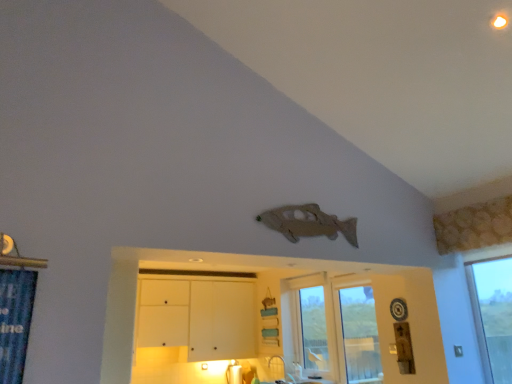
Consider the image. Measure the distance between wooden fish at upper center, marked as the second dresser in a back-to-front arrangement, and camera.

7.07 feet.

Where is `blue fabric shower curtain at left`? This screenshot has height=384, width=512. blue fabric shower curtain at left is located at coordinates (15, 321).

What is the approximate width of transparent glass window at center, acting as the second window starting from the front?

The width of transparent glass window at center, acting as the second window starting from the front, is 12.19 inches.

Locate an element on the screen. white matte cabinet at lower center, which is counted as the 1th dresser, starting from the back is located at coordinates (197, 317).

Is wooden fish at upper center, marked as the second dresser in a back-to-front arrangement, positioned far away from transparent glass door at center, the 2th window from the back?

No, wooden fish at upper center, marked as the second dresser in a back-to-front arrangement, is in close proximity to transparent glass door at center, the 2th window from the back.

Is wooden fish at upper center, which is the first dresser from front to back, inside the boundaries of transparent glass door at center, the 2th window from the back, or outside?

The correct answer is: outside.

In the scene shown: Would you say wooden fish at upper center, which is the first dresser from front to back, is to the left or to the right of transparent glass door at center, which is the first window in front-to-back order, in the picture?

Clearly, wooden fish at upper center, which is the first dresser from front to back, is on the left of transparent glass door at center, which is the first window in front-to-back order, in the image.

Is the position of wooden fish at upper center, marked as the second dresser in a back-to-front arrangement, more distant than that of transparent glass door at center, which is the first window in front-to-back order?

No, wooden fish at upper center, marked as the second dresser in a back-to-front arrangement, is in front of transparent glass door at center, which is the first window in front-to-back order.

Is transparent glass window at center, acting as the second window starting from the front, inside blue fabric shower curtain at left?

No, transparent glass window at center, acting as the second window starting from the front, is not a part of blue fabric shower curtain at left.

Which point is more distant from viewer, [34,271] or [308,346]?

Positioned behind is point [308,346].

How many degrees apart are the facing directions of blue fabric shower curtain at left and transparent glass window at center, acting as the second window starting from the front?

The angle between the facing direction of blue fabric shower curtain at left and the facing direction of transparent glass window at center, acting as the second window starting from the front, is 92 degrees.

You are a GUI agent. You are given a task and a screenshot of the screen. Output one action in this format:
    pyautogui.click(x=<x>, y=<y>)
    Task: Click on the shower curtain above the transparent glass window at center, which appears as the first window when viewed from the back (from a real-world perspective)
    The image size is (512, 384).
    Given the screenshot: What is the action you would take?
    pyautogui.click(x=15, y=321)

Is transparent glass door at center, which is the first window in front-to-back order, far away from wooden fish at upper center, which is the first dresser from front to back?

No, transparent glass door at center, which is the first window in front-to-back order, is in close proximity to wooden fish at upper center, which is the first dresser from front to back.

Is transparent glass door at center, which is the first window in front-to-back order, to the left or to the right of wooden fish at upper center, marked as the second dresser in a back-to-front arrangement, in the image?

Clearly, transparent glass door at center, which is the first window in front-to-back order, is on the right of wooden fish at upper center, marked as the second dresser in a back-to-front arrangement, in the image.

From the image's perspective, does transparent glass door at center, the 2th window from the back, appear higher than wooden fish at upper center, marked as the second dresser in a back-to-front arrangement?

Incorrect, from the image's perspective, transparent glass door at center, the 2th window from the back, is lower than wooden fish at upper center, marked as the second dresser in a back-to-front arrangement.

Choose the correct answer: Is transparent glass door at center, the 2th window from the back, inside wooden fish at upper center, which is the first dresser from front to back, or outside it?

transparent glass door at center, the 2th window from the back, is outside wooden fish at upper center, which is the first dresser from front to back.

Would you say blue fabric shower curtain at left is inside or outside white matte cabinet at lower center, which is counted as the 1th dresser, starting from the back?

blue fabric shower curtain at left lies outside white matte cabinet at lower center, which is counted as the 1th dresser, starting from the back.

From a real-world perspective, is blue fabric shower curtain at left positioned above or below white matte cabinet at lower center, positioned as the 2th dresser in front-to-back order?

In terms of real-world spatial position, blue fabric shower curtain at left is below white matte cabinet at lower center, positioned as the 2th dresser in front-to-back order.

Considering the relative positions of blue fabric shower curtain at left and white matte cabinet at lower center, positioned as the 2th dresser in front-to-back order, in the image provided, is blue fabric shower curtain at left in front of white matte cabinet at lower center, positioned as the 2th dresser in front-to-back order,?

Yes, blue fabric shower curtain at left is in front of white matte cabinet at lower center, positioned as the 2th dresser in front-to-back order.

Is point (376, 355) farther from camera compared to point (180, 315)?

No, (376, 355) is closer to viewer.

Does transparent glass door at center, which is the first window in front-to-back order, turn towards white matte cabinet at lower center, which is counted as the 1th dresser, starting from the back?

No, transparent glass door at center, which is the first window in front-to-back order, does not turn towards white matte cabinet at lower center, which is counted as the 1th dresser, starting from the back.

Between transparent glass door at center, the 2th window from the back, and white matte cabinet at lower center, positioned as the 2th dresser in front-to-back order, which one is positioned behind?

white matte cabinet at lower center, positioned as the 2th dresser in front-to-back order.

From the image's perspective, relative to wooden fish at upper center, which is the first dresser from front to back, is blue fabric shower curtain at left above or below?

Clearly, from the image's perspective, blue fabric shower curtain at left is above wooden fish at upper center, which is the first dresser from front to back.

From the picture: Is blue fabric shower curtain at left at the left side of wooden fish at upper center, marked as the second dresser in a back-to-front arrangement?

Yes.

Find the location of a particular element. Image resolution: width=512 pixels, height=384 pixels. shower curtain that is above the wooden fish at upper center, marked as the second dresser in a back-to-front arrangement (from the image's perspective) is located at coordinates (15, 321).

Does point (359, 360) come behind point (242, 294)?

No.

You are a GUI agent. You are given a task and a screenshot of the screen. Output one action in this format:
    pyautogui.click(x=<x>, y=<y>)
    Task: Click on the 1st window in front when counting from the white matte cabinet at lower center, which is counted as the 1th dresser, starting from the back
    This screenshot has width=512, height=384.
    Given the screenshot: What is the action you would take?
    pyautogui.click(x=335, y=329)

Can you confirm if transparent glass window at center, which appears as the first window when viewed from the back, is wider than white matte cabinet at lower center, positioned as the 2th dresser in front-to-back order?

No, transparent glass window at center, which appears as the first window when viewed from the back, is not wider than white matte cabinet at lower center, positioned as the 2th dresser in front-to-back order.

From a real-world perspective, does transparent glass window at center, acting as the second window starting from the front, stand above white matte cabinet at lower center, which is counted as the 1th dresser, starting from the back?

No, from a real-world perspective, transparent glass window at center, acting as the second window starting from the front, is not above white matte cabinet at lower center, which is counted as the 1th dresser, starting from the back.

At what (x,y) coordinates should I click in order to perform the action: click on dresser lying in front of the transparent glass door at center, which is the first window in front-to-back order. Please return your answer as a coordinate pair (x, y). The height and width of the screenshot is (384, 512). Looking at the image, I should click on (262, 271).

This screenshot has width=512, height=384. I want to click on the 1st window to the right of the blue fabric shower curtain at left, starting your count from the anchor, so click(335, 329).

When comparing their distances from white matte cabinet at lower center, which is counted as the 1th dresser, starting from the back, does transparent glass door at center, the 2th window from the back, or matte gray fish at upper center seem closer?

transparent glass door at center, the 2th window from the back, lies closer to white matte cabinet at lower center, which is counted as the 1th dresser, starting from the back, than the other object.

Looking at the image, which one is located further to wooden fish at upper center, marked as the second dresser in a back-to-front arrangement, transparent glass window at center, acting as the second window starting from the front, or white matte cabinet at lower center, which is counted as the 1th dresser, starting from the back?

Among the two, white matte cabinet at lower center, which is counted as the 1th dresser, starting from the back, is located further to wooden fish at upper center, marked as the second dresser in a back-to-front arrangement.

When comparing their distances from wooden fish at upper center, marked as the second dresser in a back-to-front arrangement, does transparent glass door at center, the 2th window from the back, or transparent glass window at center, acting as the second window starting from the front, seem closer?

transparent glass door at center, the 2th window from the back, is closer to wooden fish at upper center, marked as the second dresser in a back-to-front arrangement.

Estimate the real-world distances between objects in this image. Which object is further from white matte cabinet at lower center, positioned as the 2th dresser in front-to-back order, transparent glass window at center, acting as the second window starting from the front, or matte gray fish at upper center?

Based on the image, matte gray fish at upper center appears to be further to white matte cabinet at lower center, positioned as the 2th dresser in front-to-back order.

Which object lies nearer to the anchor point transparent glass window at center, acting as the second window starting from the front, transparent glass door at center, which is the first window in front-to-back order, or white matte cabinet at lower center, which is counted as the 1th dresser, starting from the back?

Based on the image, transparent glass door at center, which is the first window in front-to-back order, appears to be nearer to transparent glass window at center, acting as the second window starting from the front.

When comparing their distances from transparent glass window at center, which appears as the first window when viewed from the back, does wooden fish at upper center, which is the first dresser from front to back, or transparent glass door at center, the 2th window from the back, seem closer?

transparent glass door at center, the 2th window from the back, lies closer to transparent glass window at center, which appears as the first window when viewed from the back, than the other object.

Looking at the image, which one is located further to matte gray fish at upper center, transparent glass door at center, the 2th window from the back, or blue fabric shower curtain at left?

transparent glass door at center, the 2th window from the back, lies further to matte gray fish at upper center than the other object.

From the image, which object appears to be farther from matte gray fish at upper center, transparent glass window at center, which appears as the first window when viewed from the back, or blue fabric shower curtain at left?

transparent glass window at center, which appears as the first window when viewed from the back.

Where is `fish between blue fabric shower curtain at left and white matte cabinet at lower center, positioned as the 2th dresser in front-to-back order, from front to back`? fish between blue fabric shower curtain at left and white matte cabinet at lower center, positioned as the 2th dresser in front-to-back order, from front to back is located at coordinates (308, 223).

Where is `window located between matte gray fish at upper center and transparent glass window at center, which appears as the first window when viewed from the back, in the depth direction`? This screenshot has width=512, height=384. window located between matte gray fish at upper center and transparent glass window at center, which appears as the first window when viewed from the back, in the depth direction is located at coordinates (360, 336).

The height and width of the screenshot is (384, 512). In order to click on window between blue fabric shower curtain at left and transparent glass window at center, acting as the second window starting from the front, from front to back in this screenshot , I will do `click(360, 336)`.

Locate an element on the screen. dresser positioned between blue fabric shower curtain at left and transparent glass door at center, which is the first window in front-to-back order, from near to far is located at coordinates (262, 271).